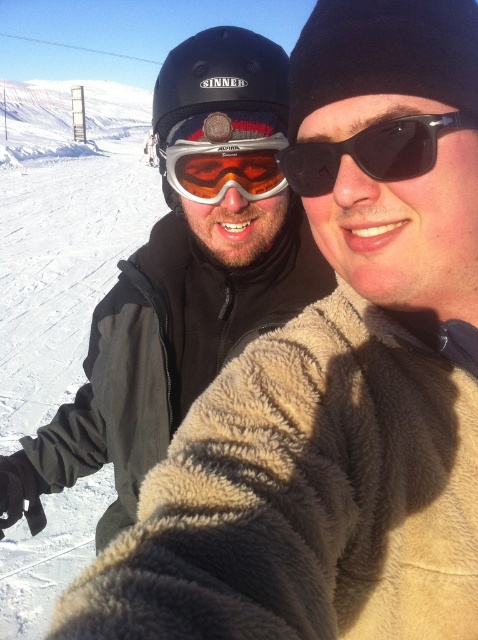
You are planning to take a photo of the two people in the snowy scene. The matte black goggles at upper center and the matte orange ski goggles at center are both visible. Which goggles should you focus on if you want to ensure both are in sharp focus?

You should focus on the matte orange ski goggles at center because the matte black goggles at upper center is in front of it, so focusing on the one behind might require adjusting the focus to include both layers.

You are a photographer at a ski resort. You need to capture a photo where both the matte black goggles at upper center and the matte orange ski goggles at center are clearly visible. Which pair of goggles will appear smaller in the final photo?

The matte black goggles at upper center has a lesser height compared to the matte orange ski goggles at center, so the matte black goggles at upper center will appear smaller in the final photo.

You are a photographer trying to capture the scene with the matte black goggles at upper center and the matte orange ski goggles at center. Which goggles are positioned higher in the image?

The matte orange ski goggles at center are positioned higher in the image because the matte black goggles at upper center is located below them.